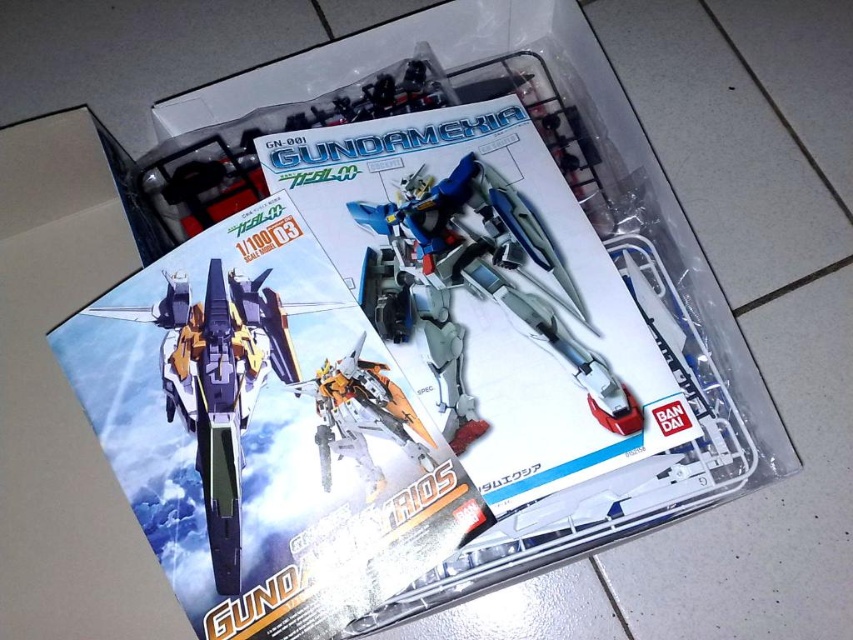
Between matte silver fighter jet at center and metallic silver robot at center, which one is positioned higher?

metallic silver robot at center is higher up.

Between matte silver fighter jet at center and metallic silver robot at center, which one is positioned lower?

matte silver fighter jet at center

Does point (241, 397) come farther from viewer compared to point (352, 353)?

No.

Identify the location of matte silver fighter jet at center. (218, 385).